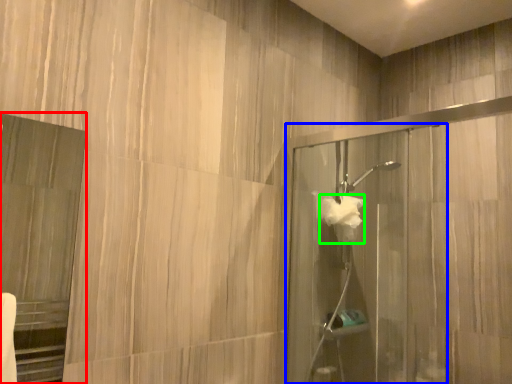
Question: Based on their relative distances, which object is farther from screen door (highlighted by a red box)? Choose from screen door (highlighted by a blue box) and hand towel (highlighted by a green box).

Choices:
 (A) screen door
 (B) hand towel

Answer: (B)